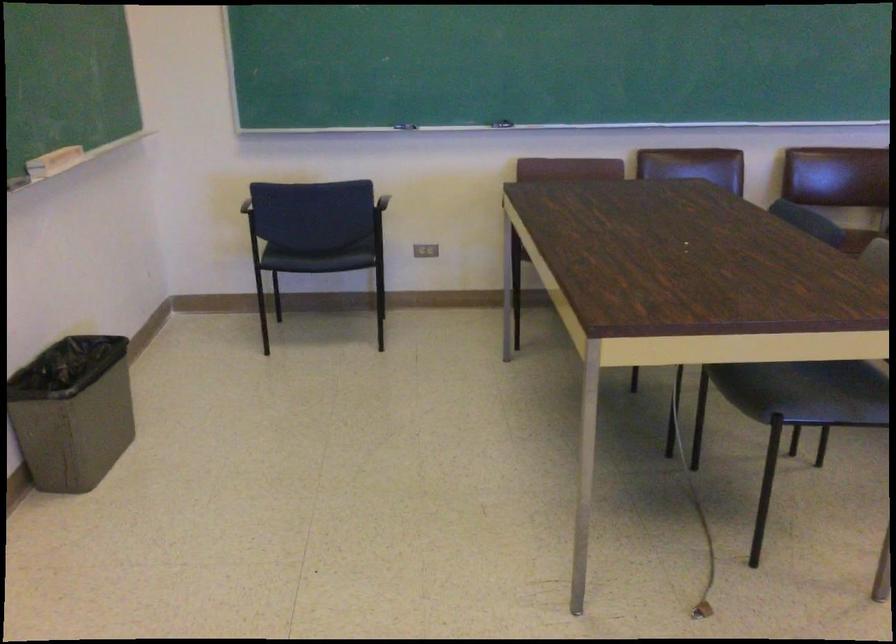
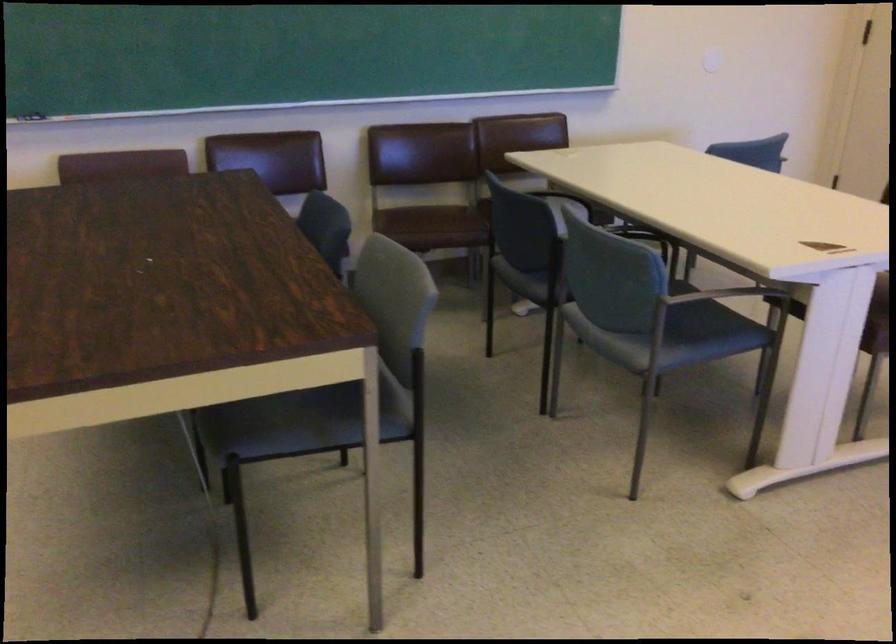
Question: The images are taken continuously from a first-person perspective. In which direction are you moving?

Choices:
 (A) Left
 (B) Right
 (C) Forward
 (D) Backward

Answer: (B)